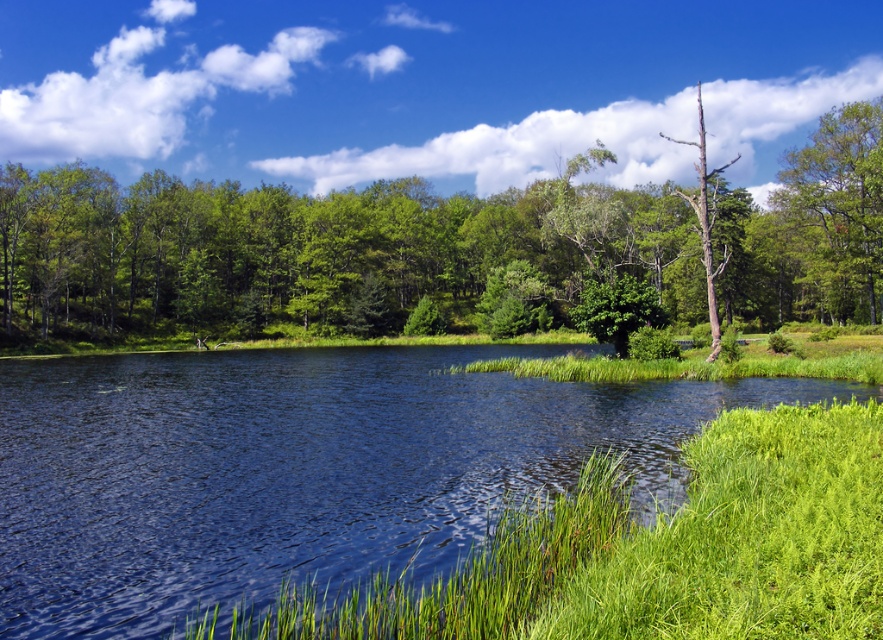
You are standing at the edge of the blue water at center and want to walk to the green leafy tree at upper right. Which direction should you head to reach the tree?

The green leafy tree at upper right is located to the upper right of the blue water at center, so you should head in the upper right direction to reach it.

You are a bird seeking shelter. You see a green leafy tree at upper right and a bare wood tree at right. Which tree would you choose for nesting based on their positions?

The green leafy tree at upper right is in front of the bare wood tree at right, so the green leafy tree at upper right would provide better shelter for nesting as it is closer and offers more foliage coverage.